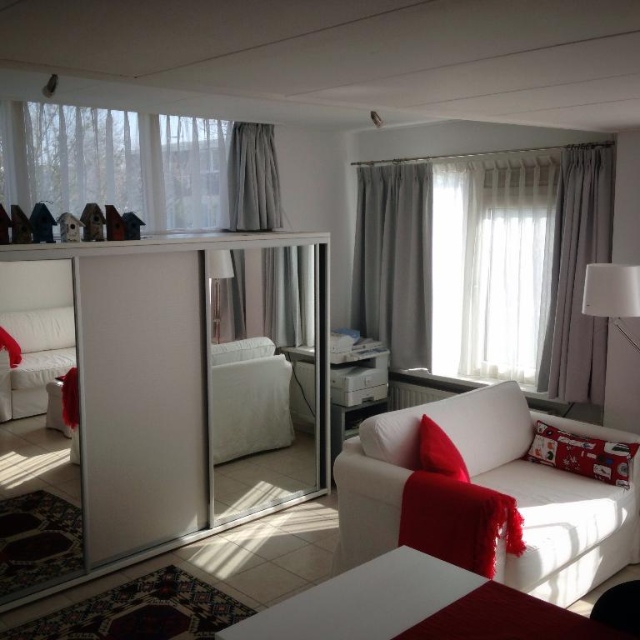
Who is higher up, gray sheer curtain at upper center or white glossy lampshade at upper right?

gray sheer curtain at upper center is above.

Does gray sheer curtain at upper center have a greater width compared to white glossy lampshade at upper right?

Yes, gray sheer curtain at upper center is wider than white glossy lampshade at upper right.

Identify the location of gray sheer curtain at upper center. (394, 257).

How far apart are white glossy sliding door at left and gray fabric curtain at right?

white glossy sliding door at left and gray fabric curtain at right are 7.90 feet apart.

Can you confirm if white glossy sliding door at left is bigger than gray fabric curtain at right?

Yes, white glossy sliding door at left is bigger than gray fabric curtain at right.

Is point (22, 401) farther from camera compared to point (566, 211)?

No.

The image size is (640, 640). I want to click on white glossy sliding door at left, so click(166, 390).

Measure the distance between white glossy coffee table at lower center and gray fabric curtain at right.

The distance of white glossy coffee table at lower center from gray fabric curtain at right is 8.68 feet.

You are a GUI agent. You are given a task and a screenshot of the screen. Output one action in this format:
    pyautogui.click(x=<x>, y=<y>)
    Task: Click on the white glossy coffee table at lower center
    The width and height of the screenshot is (640, 640).
    Given the screenshot: What is the action you would take?
    pyautogui.click(x=365, y=600)